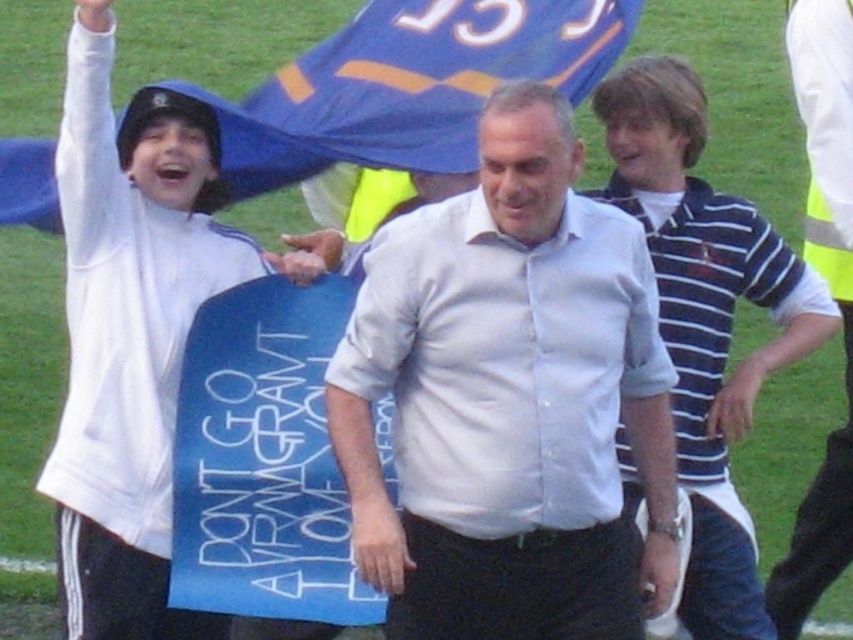
You are a photographer standing at the camera position. You want to take a closeup photo of the blue striped polo shirt at center. Is it possible to focus on it clearly without moving the camera?

The blue striped polo shirt at center is 7.67 meters away from the camera. Since the distance is fixed and you cannot move the camera, you can adjust the camera settings like aperture or zoom lens to focus on the subject at that distance, so yes, it is possible to take a clear closeup photo without moving the camera.

You are standing at the point marked as point (x=508, y=400) on the image. What object are you standing on?

You are standing on the white cotton shirt at center.